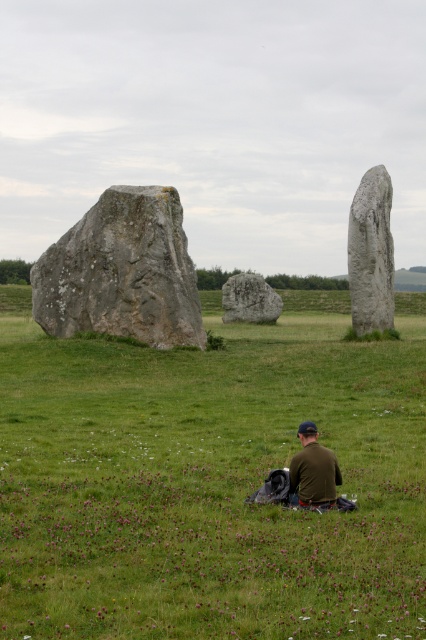
Is smooth gray stone at right above dark green shirt at center?

Yes, smooth gray stone at right is above dark green shirt at center.

Is smooth gray stone at right wider than dark green shirt at center?

Yes.

Is point (365, 173) positioned after point (330, 500)?

Yes, point (365, 173) is behind point (330, 500).

The height and width of the screenshot is (640, 426). What are the coordinates of `smooth gray stone at right` in the screenshot? It's located at (371, 250).

Is rough stone monolith at left positioned behind smooth gray stone at right?

No, rough stone monolith at left is in front of smooth gray stone at right.

Does rough stone monolith at left have a lesser height compared to smooth gray stone at right?

Correct, rough stone monolith at left is not as tall as smooth gray stone at right.

What do you see at coordinates (121, 273) in the screenshot?
I see `rough stone monolith at left` at bounding box center [121, 273].

You are a GUI agent. You are given a task and a screenshot of the screen. Output one action in this format:
    pyautogui.click(x=<x>, y=<y>)
    Task: Click on the rough stone monolith at left
    The width and height of the screenshot is (426, 640).
    Given the screenshot: What is the action you would take?
    pyautogui.click(x=121, y=273)

Based on the photo, does dark green shirt at center have a smaller size compared to gray stone boulder at center?

Yes.

Does dark green shirt at center have a greater height compared to gray stone boulder at center?

Incorrect, dark green shirt at center's height is not larger of gray stone boulder at center's.

Is point (325, 461) closer to camera compared to point (227, 308)?

Yes, point (325, 461) is closer to viewer.

Find the location of `dark green shirt at center`. dark green shirt at center is located at coordinates (313, 468).